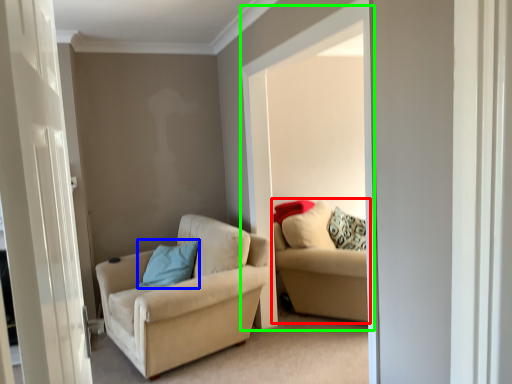
Question: Which object is positioned farthest from studio couch (highlighted by a red box)? Select from pillow (highlighted by a blue box) and window (highlighted by a green box).

Choices:
 (A) pillow
 (B) window

Answer: (A)